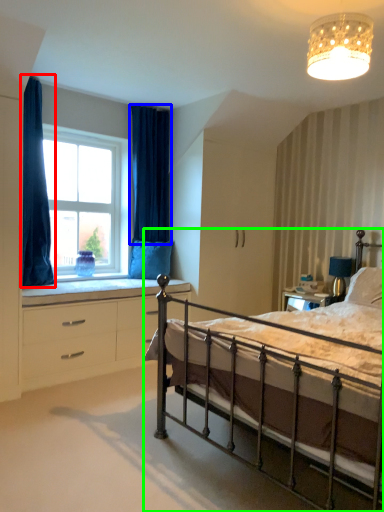
Question: Estimate the real-world distances between objects in this image. Which object is closer to curtain (highlighted by a red box), curtain (highlighted by a blue box) or bed (highlighted by a green box)?

Choices:
 (A) curtain
 (B) bed

Answer: (A)